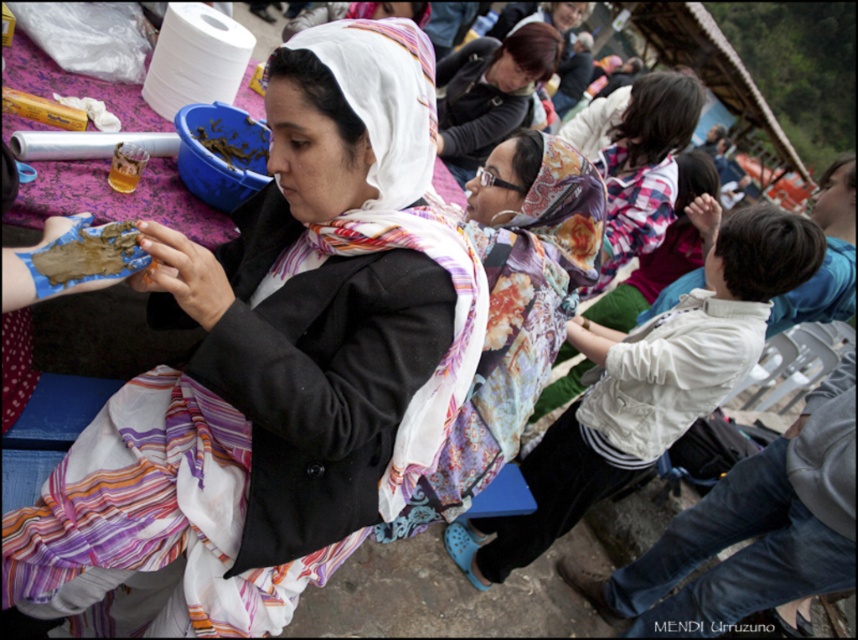
Who is lower down, matte black jacket at center or matte black jacket at upper center?

matte black jacket at center is lower down.

Who is more distant from viewer, [304,140] or [436,68]?

The point [436,68] is more distant.

Locate an element on the screen. This screenshot has height=640, width=858. matte black jacket at center is located at coordinates (273, 369).

Does striped silk scarf at center appear over white printed scarf at center?

No.

Measure the distance between point [183,435] and camera.

Point [183,435] is 5.06 feet from camera.

Does point (5, 547) come closer to viewer compared to point (418, 188)?

No, (5, 547) is further to viewer.

Locate an element on the screen. Image resolution: width=858 pixels, height=640 pixels. striped silk scarf at center is located at coordinates (154, 518).

Measure the distance from brown clay hand at center to brown clay at center.

A distance of 93.53 centimeters exists between brown clay hand at center and brown clay at center.

Which of these two, brown clay hand at center or brown clay at center, stands taller?

brown clay at center is taller.

Locate an element on the screen. The width and height of the screenshot is (858, 640). brown clay hand at center is located at coordinates (86, 256).